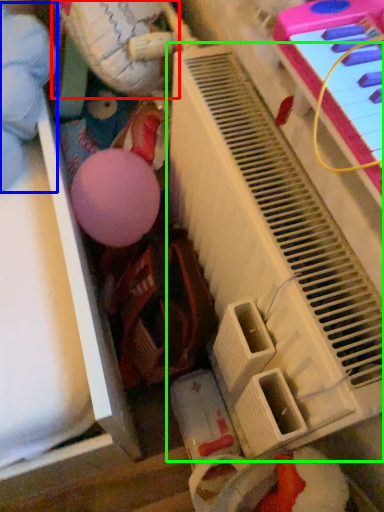
Question: Which object is positioned farthest from toy (highlighted by a red box)? Select from toy (highlighted by a blue box) and piano (highlighted by a green box).

Choices:
 (A) toy
 (B) piano

Answer: (B)